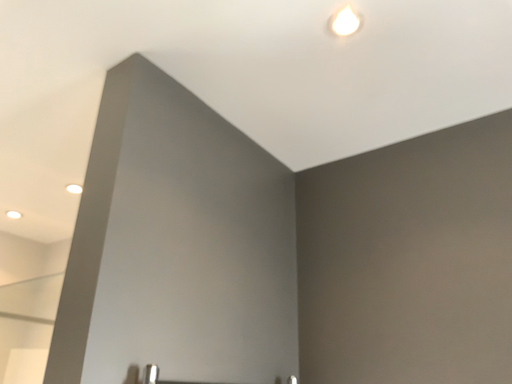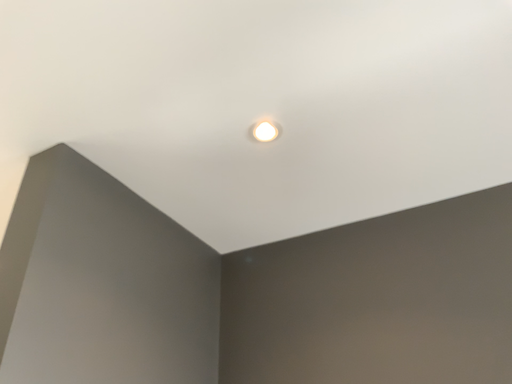
Question: How did the camera likely rotate when shooting the video?

Choices:
 (A) rotated upward
 (B) rotated downward

Answer: (A)